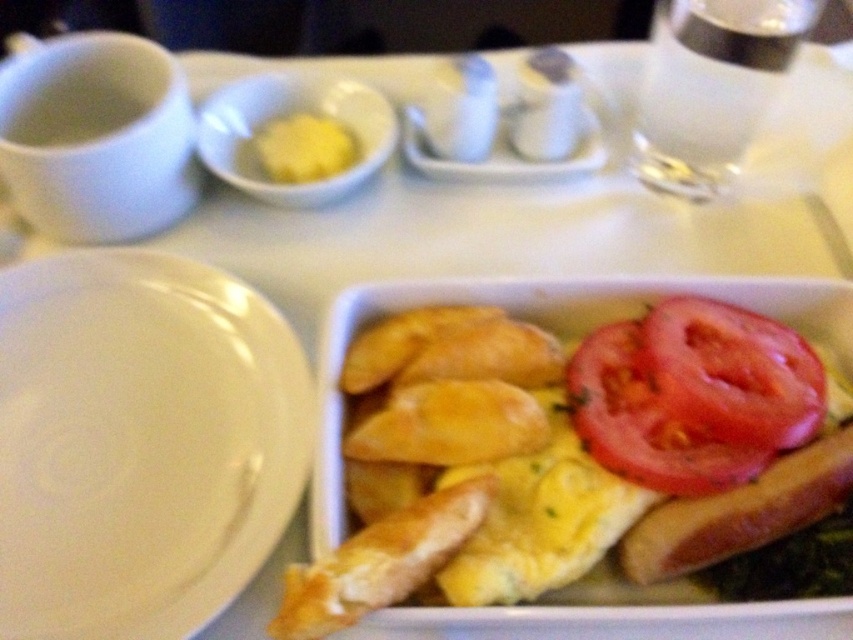
Question: Based on their relative distances, which object is nearer to the white glossy plate at center left?

Choices:
 (A) yellow fried egg at center
 (B) sliced red tomato at center
 (C) white glossy salt and pepper shakers at center

Answer: (A)

Question: Which of the following is the farthest from the observer?

Choices:
 (A) white glossy plate at center left
 (B) sliced red tomato at center
 (C) yellow fried egg at center
 (D) white glossy salt and pepper shakers at center

Answer: (D)

Question: Can you confirm if yellow fried egg at center is smaller than white glossy salt and pepper shakers at center?

Choices:
 (A) no
 (B) yes

Answer: (A)

Question: From the image, what is the correct spatial relationship of yellow fried egg at center in relation to white glossy salt and pepper shakers at center?

Choices:
 (A) below
 (B) above

Answer: (A)

Question: Is yellow fried egg at center to the right of white glossy plate at center left from the viewer's perspective?

Choices:
 (A) no
 (B) yes

Answer: (B)

Question: Estimate the real-world distances between objects in this image. Which object is farther from the white glossy salt and pepper shakers at center?

Choices:
 (A) white glossy plate at center left
 (B) sliced red tomato at center

Answer: (A)